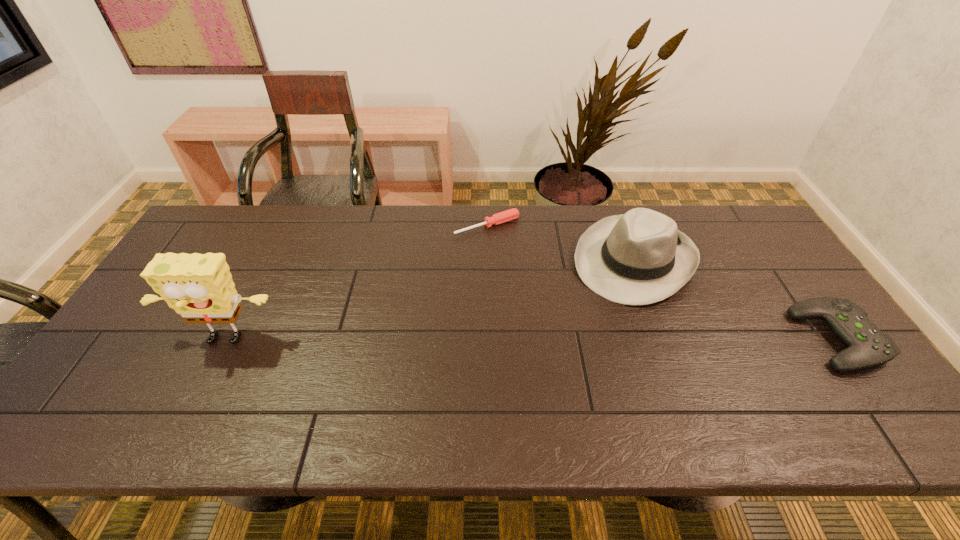
Locate an element on the screen. Image resolution: width=960 pixels, height=540 pixels. the tallest object is located at coordinates [x=199, y=287].

This screenshot has width=960, height=540. What are the coordinates of `sponge` in the screenshot? It's located at (199, 287).

This screenshot has height=540, width=960. Identify the location of control. tap(868, 346).

Image resolution: width=960 pixels, height=540 pixels. What are the coordinates of `the rightmost object` in the screenshot? It's located at (868, 346).

The width and height of the screenshot is (960, 540). I want to click on screwdriver, so click(511, 214).

Locate an element on the screen. the third object from right to left is located at coordinates (511, 214).

Where is `the third object from left to right`? the third object from left to right is located at coordinates [x=638, y=258].

Identify the location of the second tallest object. The height and width of the screenshot is (540, 960). (638, 258).

Find the location of `vacant space located 0.150m on the left of the third tallest object`. vacant space located 0.150m on the left of the third tallest object is located at coordinates (743, 339).

Identify the location of vacant space positioned at the blade of the screwdriver. This screenshot has width=960, height=540. (574, 319).